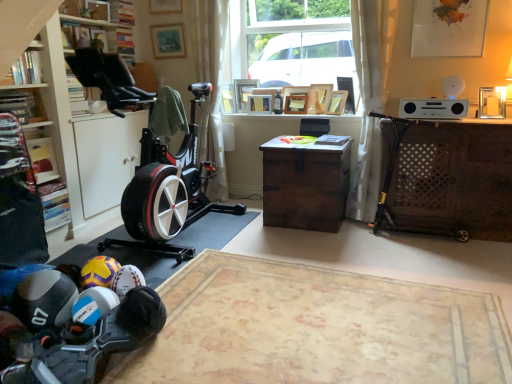
Identify the location of free area in between wooden desk at right, the 1th desk in the right-to-left sequence, and rubberized black dumbbells at lower left. (330, 284).